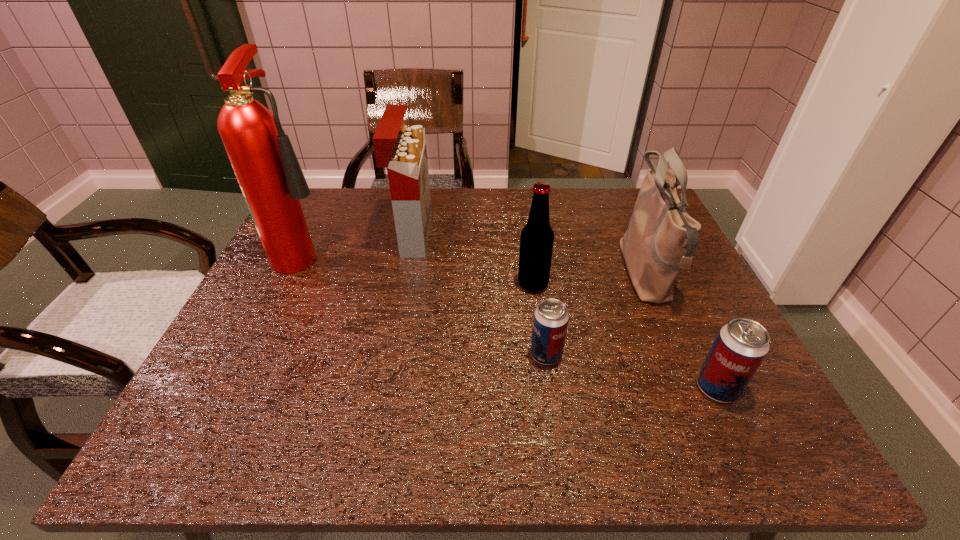
This screenshot has height=540, width=960. In order to click on the shorter beer can in this screenshot , I will do `click(551, 318)`.

I want to click on the second nearest object, so click(x=551, y=318).

This screenshot has width=960, height=540. What are the coordinates of `the nearer beer can` in the screenshot? It's located at (741, 345).

This screenshot has height=540, width=960. Find the location of `the right beer can`. the right beer can is located at coordinates (741, 345).

Identify the location of fire extinguisher. The width and height of the screenshot is (960, 540). (272, 182).

Find the location of a particular element. The image size is (960, 540). the leftmost object is located at coordinates (272, 182).

I want to click on cigarette case, so click(x=401, y=149).

You are a GUI agent. You are given a task and a screenshot of the screen. Output one action in this format:
    pyautogui.click(x=<x>, y=<y>)
    Task: Click on the shoulder bag
    This screenshot has width=960, height=540.
    Given the screenshot: What is the action you would take?
    pyautogui.click(x=661, y=238)

Identify the location of the third shortest object. (536, 241).

This screenshot has width=960, height=540. In order to click on vacant region located on the back of the left beer can in this screenshot , I will do `click(534, 266)`.